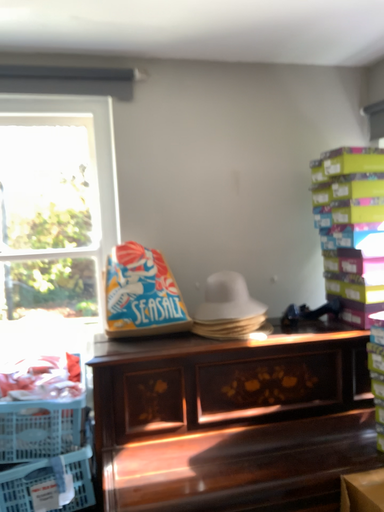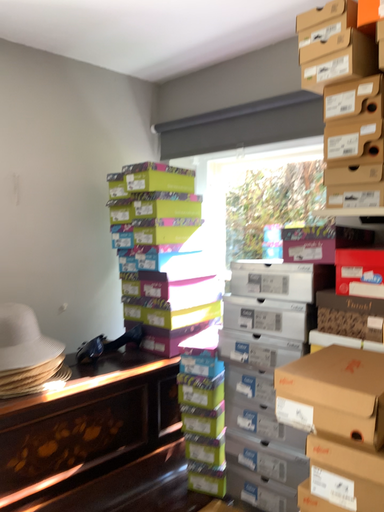
Question: Which way did the camera rotate in the video?

Choices:
 (A) rotated right
 (B) rotated left

Answer: (A)